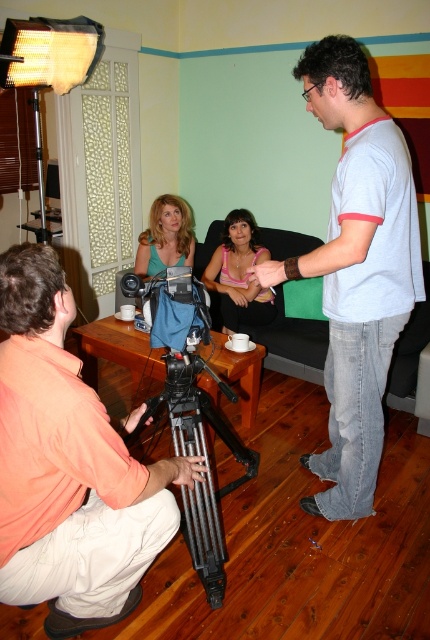
You are a video director observing the scene. You notice the matte black hand at center and the blonde hair at center. Which object is positioned further away from the camera?

The matte black hand at center is behind the blonde hair at center, so it is further away from the camera.

You are a video production assistant and need to position a microphone stand between the camera and the blonde hair at center. Based on their positions, can you determine if the microphone stand will fit between them?

The blonde hair at center is located at point (165, 236). Since the camera is mounted on a tripod and the microphone stand requires space between them, the distance must be checked. However, without specific measurements of the camera setup and microphone stand dimensions, it is uncertain if they can fit. Additional information is needed to confirm.